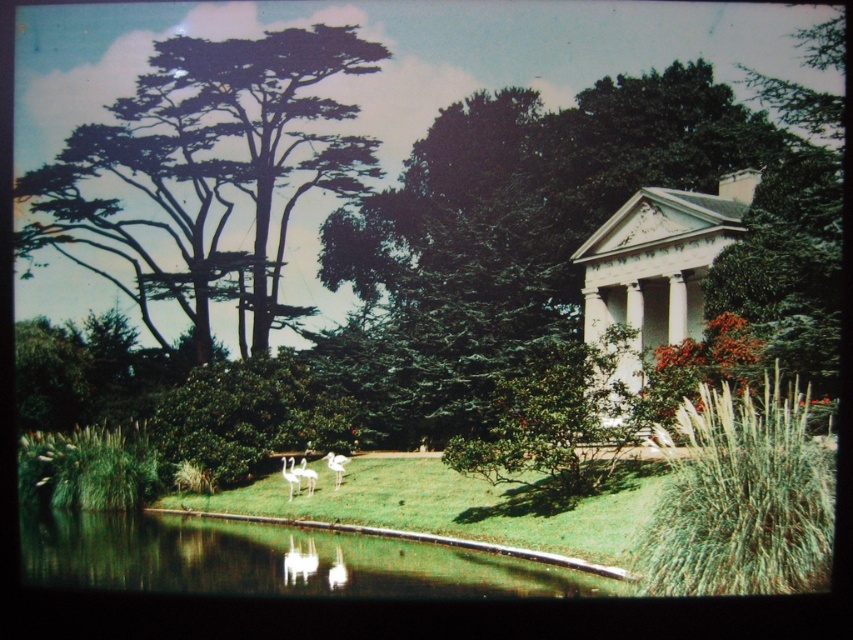
Question: Among these points, which one is nearest to the camera?

Choices:
 (A) (732, 186)
 (B) (315, 476)

Answer: (B)

Question: Based on their relative distances, which object is farther from the white fluffy swan at center?

Choices:
 (A) green textured tree at upper left
 (B) white feathered flamingo at center
 (C) clear water at pond center

Answer: (A)

Question: Which object is positioned farthest from the white feathered flamingo at center?

Choices:
 (A) white feathered swan at center
 (B) white glossy gazebo at right

Answer: (B)

Question: From the image, what is the correct spatial relationship of white feathered swan at center in relation to white feathered flamingo at center?

Choices:
 (A) below
 (B) above

Answer: (B)

Question: Considering the relative positions of white glossy gazebo at right and white feathered swan at center in the image provided, where is white glossy gazebo at right located with respect to white feathered swan at center?

Choices:
 (A) below
 (B) above

Answer: (B)

Question: Is green textured tree at upper left closer to camera compared to clear water at pond center?

Choices:
 (A) no
 (B) yes

Answer: (A)